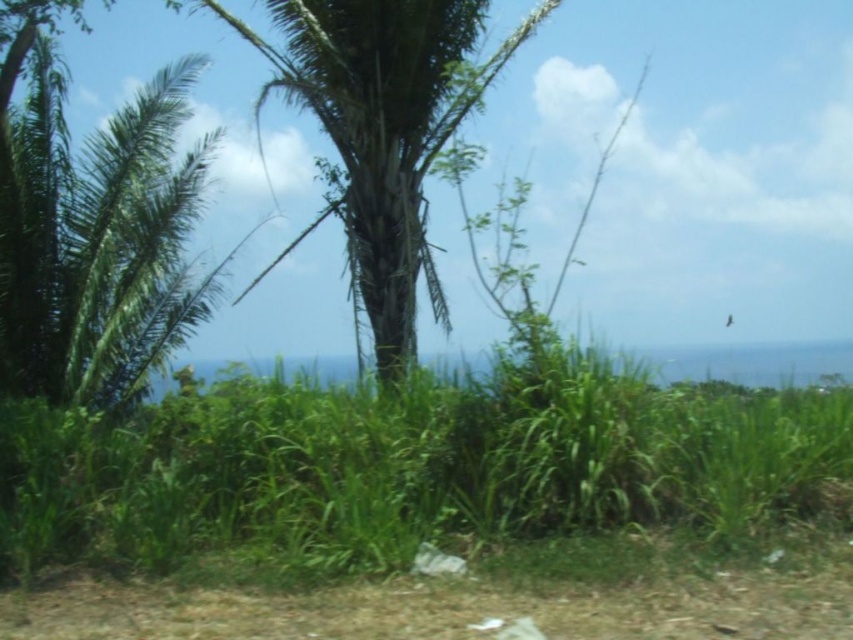
Looking at this image, you are a gardener planning to mow the green leafy grass at lower center and trim the green leafy palm tree at center. Which area requires a wider path for your equipment?

The green leafy grass at lower center requires a wider path for equipment since its width surpasses that of the green leafy palm tree at center.

You are a gardener standing at the edge of the tropical landscape. You need to place a small statue between the green leafy grass at lower center and the green leafy palm tree at center. Where should you place it so that it is between them?

The green leafy grass at lower center is below the green leafy palm tree at center, so placing the statue between them would require positioning it in the space directly beneath the palm tree where the grass is located.

You are standing in the tropical landscape and want to walk towards the ocean. You see the green leafy grass at lower center and the green leafy palm tree at center. Which object would you need to step over first as you move forward?

The green leafy grass at lower center is in front of the green leafy palm tree at center, so you would need to step over the green leafy grass at lower center first.